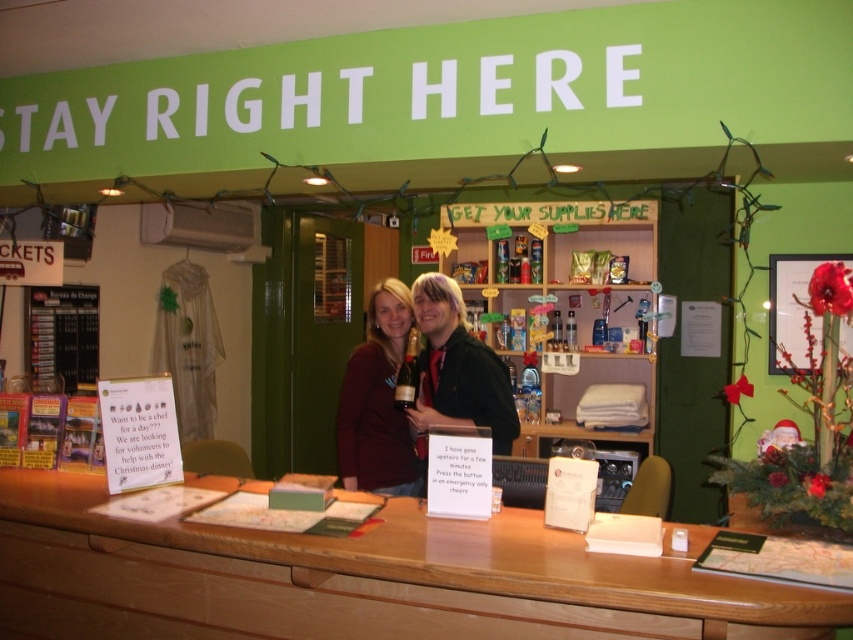
Question: Which object is farther from the camera taking this photo?

Choices:
 (A) wooden at center
 (B) matte black bottle at center

Answer: (B)

Question: Which of these objects is positioned closest to the matte black sweater at center?

Choices:
 (A) wooden at center
 (B) matte black bottle at center

Answer: (B)

Question: Is matte black bottle at center to the right of matte black sweater at center from the viewer's perspective?

Choices:
 (A) yes
 (B) no

Answer: (A)

Question: Where is matte black bottle at center located in relation to matte black sweater at center in the image?

Choices:
 (A) right
 (B) left

Answer: (A)

Question: Can you confirm if wooden at center is bigger than matte black bottle at center?

Choices:
 (A) yes
 (B) no

Answer: (A)

Question: Estimate the real-world distances between objects in this image. Which object is closer to the wooden at center?

Choices:
 (A) matte black bottle at center
 (B) matte black sweater at center

Answer: (A)